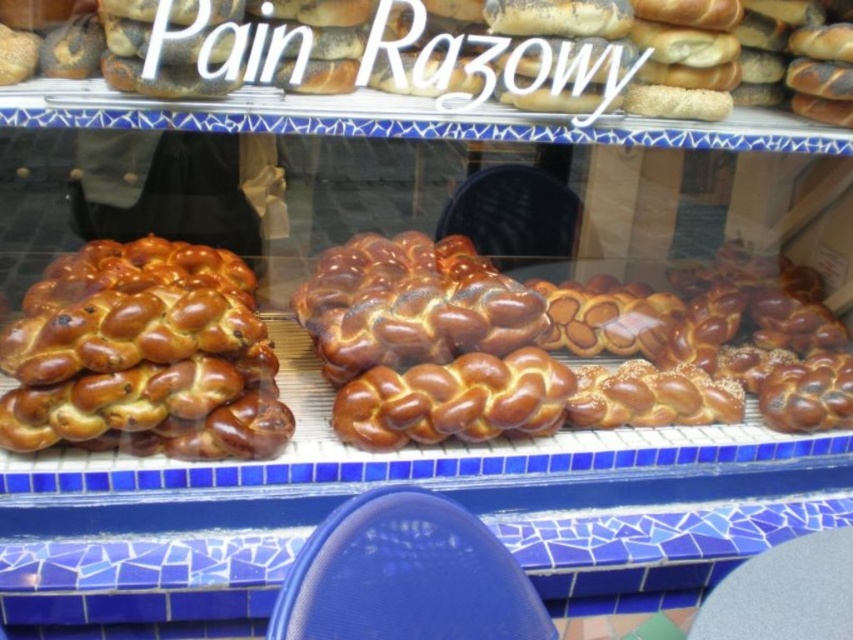
In the scene shown: Measure the distance from golden brown braided loaf at center to golden-brown braided bread at left.

golden brown braided loaf at center and golden-brown braided bread at left are 27.90 inches apart from each other.

Can you confirm if golden brown braided loaf at center is shorter than golden-brown braided bread at left?

Yes.

Find the location of `golden brown braided loaf at center`. golden brown braided loaf at center is located at coordinates (456, 52).